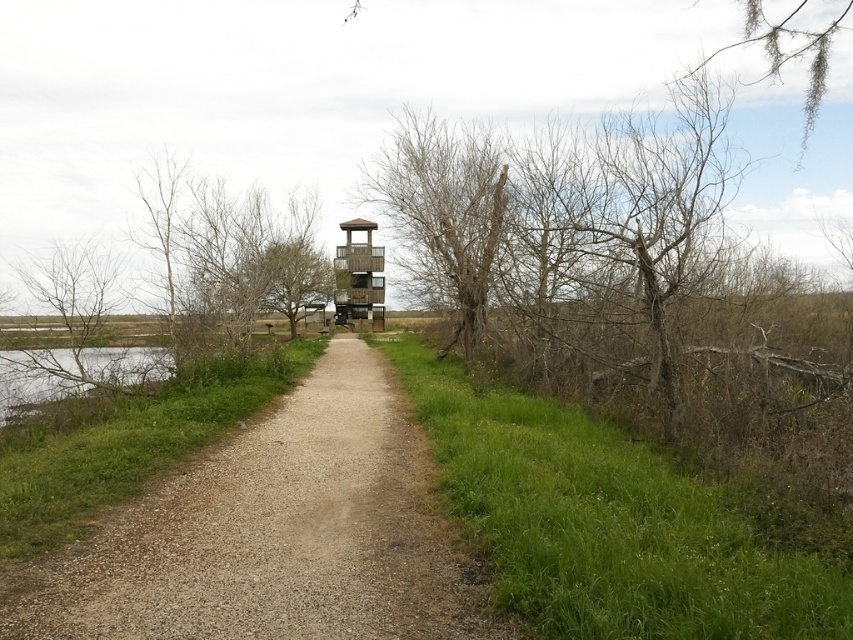
Question: Considering the relative positions of dirt/gravel path at center and bare wood tree at left in the image provided, where is dirt/gravel path at center located with respect to bare wood tree at left?

Choices:
 (A) above
 (B) below

Answer: (B)

Question: Observing the image, what is the correct spatial positioning of green grassy water at lower left in reference to wooden observation tower at center?

Choices:
 (A) above
 (B) below

Answer: (B)

Question: Can you confirm if dirt/gravel path at center is thinner than wooden observation tower at center?

Choices:
 (A) no
 (B) yes

Answer: (A)

Question: Which of the following is the closest to the observer?

Choices:
 (A) dirt/gravel path at center
 (B) bare wood tree at left

Answer: (A)

Question: Considering the real-world distances, which object is farthest from the wooden observation tower at center?

Choices:
 (A) dirt/gravel path at center
 (B) green grassy water at lower left
 (C) bare wood tree at left

Answer: (A)

Question: Which point is farther to the camera?

Choices:
 (A) dirt/gravel path at center
 (B) bare wood tree at left
 (C) green grassy water at lower left

Answer: (B)